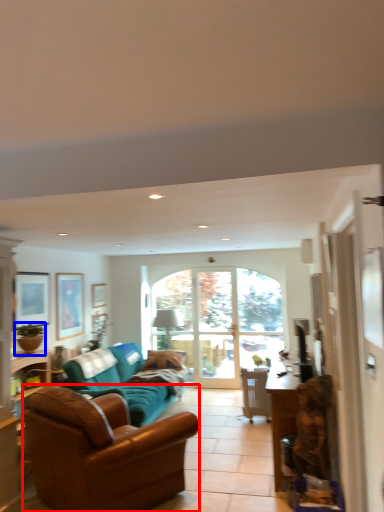
Question: Which object is further to the camera taking this photo, studio couch (highlighted by a red box) or houseplant (highlighted by a blue box)?

Choices:
 (A) studio couch
 (B) houseplant

Answer: (B)